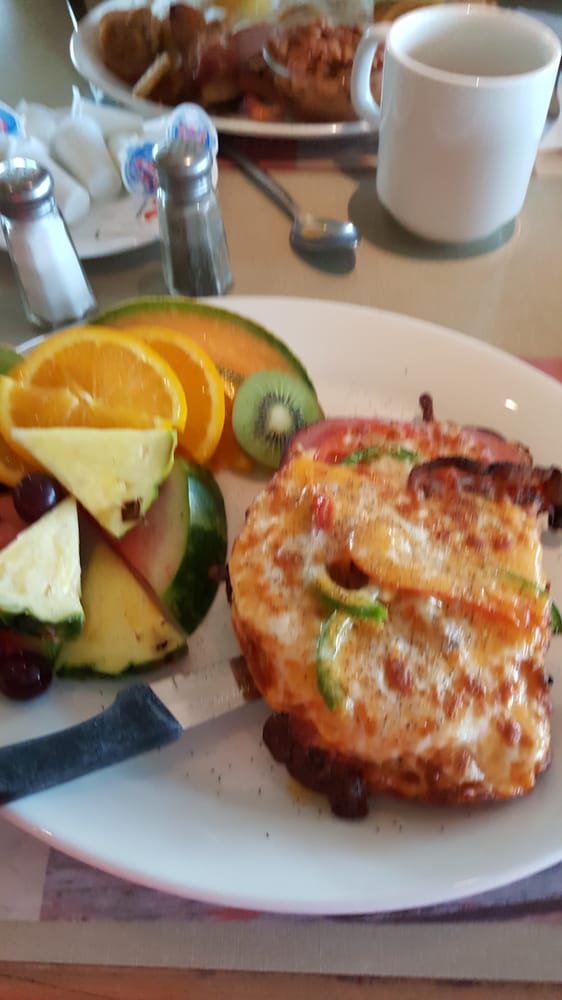
You are a GUI agent. You are given a task and a screenshot of the screen. Output one action in this format:
    pyautogui.click(x=<x>, y=<y>)
    Task: Click on the plates
    The height and width of the screenshot is (1000, 562).
    Given the screenshot: What is the action you would take?
    pyautogui.click(x=228, y=839), pyautogui.click(x=273, y=127), pyautogui.click(x=107, y=244)